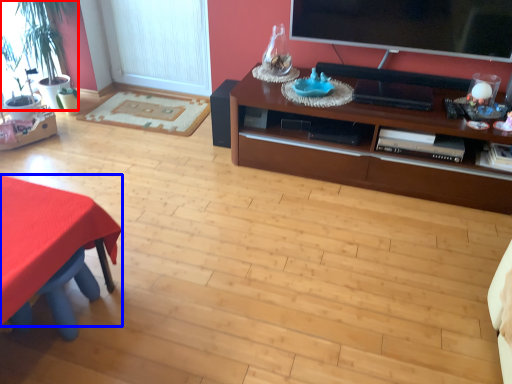
Question: Which object appears farthest to the camera in this image, houseplant (highlighted by a red box) or desk (highlighted by a blue box)?

Choices:
 (A) houseplant
 (B) desk

Answer: (A)